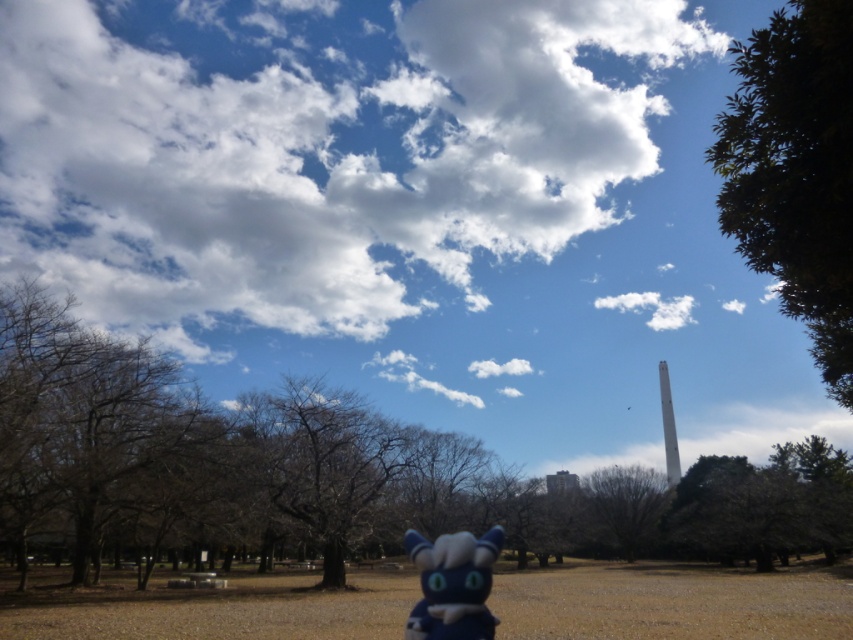
Is point (819, 282) farther from viewer compared to point (589, 509)?

No, it is not.

Between point (813, 221) and point (646, 477), which one is positioned behind?

The point (646, 477) is behind.

Where is `green leafy tree at upper right`? green leafy tree at upper right is located at coordinates (795, 172).

Which is above, brown leafless tree at lower left or blue plush toy at center?

blue plush toy at center

Is brown leafless tree at lower left wider than blue plush toy at center?

Yes, brown leafless tree at lower left is wider than blue plush toy at center.

Is point (816, 502) positioned before point (492, 544)?

No, (816, 502) is further to viewer.

Where is `brown leafless tree at lower left`? The height and width of the screenshot is (640, 853). brown leafless tree at lower left is located at coordinates (229, 465).

Can you confirm if white fluffy cloud at upper center is wider than blue plush toy at center?

Correct, the width of white fluffy cloud at upper center exceeds that of blue plush toy at center.

Can you confirm if white fluffy cloud at upper center is positioned below blue plush toy at center?

No.

This screenshot has height=640, width=853. Describe the element at coordinates (318, 154) in the screenshot. I see `white fluffy cloud at upper center` at that location.

Locate an element on the screen. white fluffy cloud at upper center is located at coordinates (318, 154).